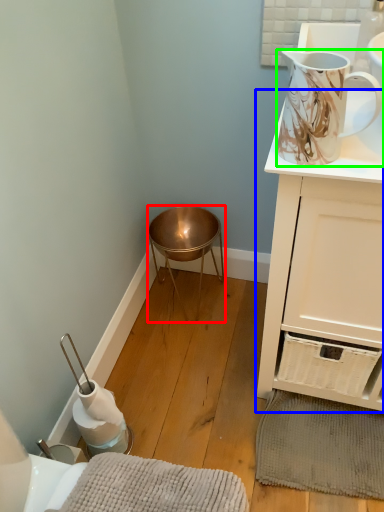
Question: Which object is the farthest from stool (highlighted by a red box)? Choose among these: cabinetry (highlighted by a blue box) or jug (highlighted by a green box).

Choices:
 (A) cabinetry
 (B) jug

Answer: (B)